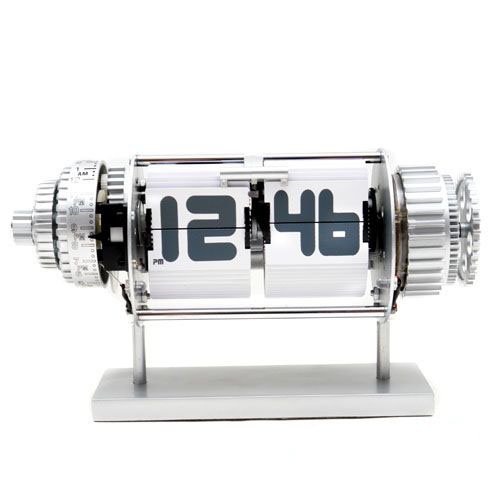
You are a GUI agent. You are given a task and a screenshot of the screen. Output one action in this format:
    pyautogui.click(x=<x>, y=<y>)
    Task: Click on the stand
    
    Given the screenshot: What is the action you would take?
    pyautogui.click(x=312, y=403)